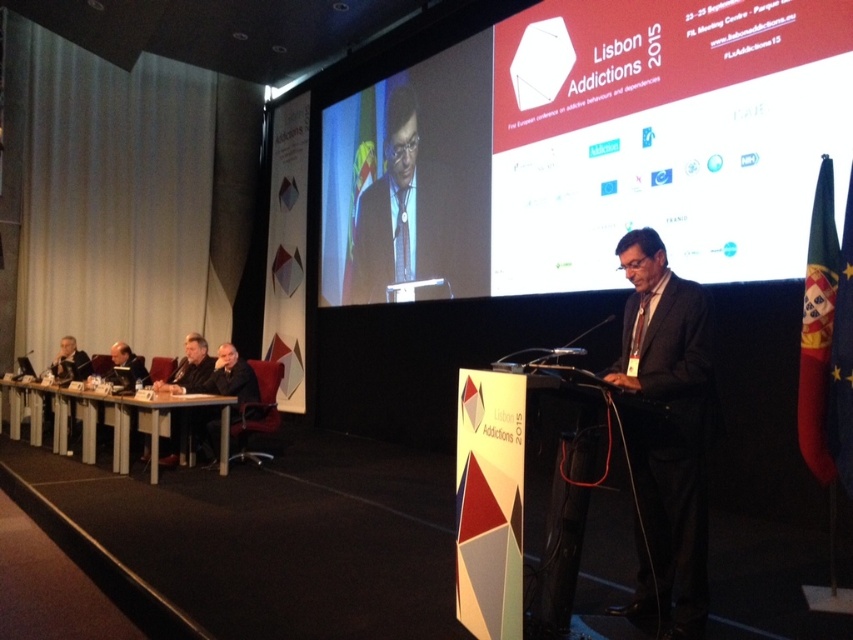
This screenshot has height=640, width=853. Describe the element at coordinates (669, 442) in the screenshot. I see `dark gray suit at center` at that location.

This screenshot has height=640, width=853. Identify the location of dark gray suit at center. (669, 442).

Can you confirm if matte black podium at center is positioned above matte black laptop at left?

Yes, matte black podium at center is above matte black laptop at left.

This screenshot has width=853, height=640. Find the location of `matte black podium at center`. matte black podium at center is located at coordinates (590, 147).

Is matte black podium at center behind dark suit at left?

That is False.

Does matte black podium at center appear under dark suit at left?

No.

Locate an element on the screen. Image resolution: width=853 pixels, height=640 pixels. matte black podium at center is located at coordinates (590, 147).